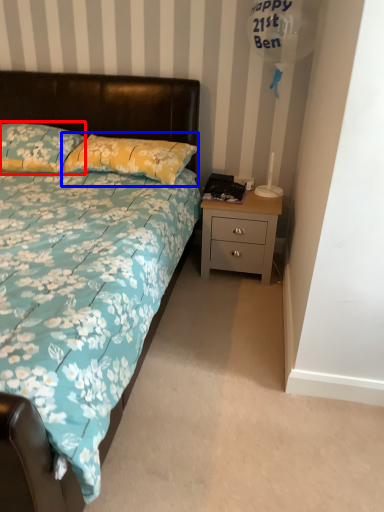
Question: Which point is further to the camera, pillow (highlighted by a red box) or pillow (highlighted by a blue box)?

Choices:
 (A) pillow
 (B) pillow

Answer: (A)